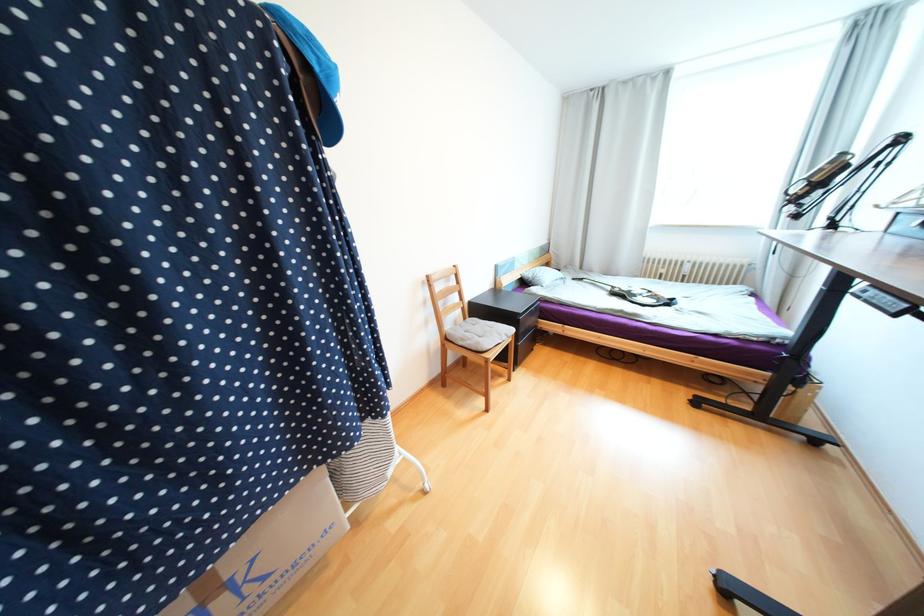
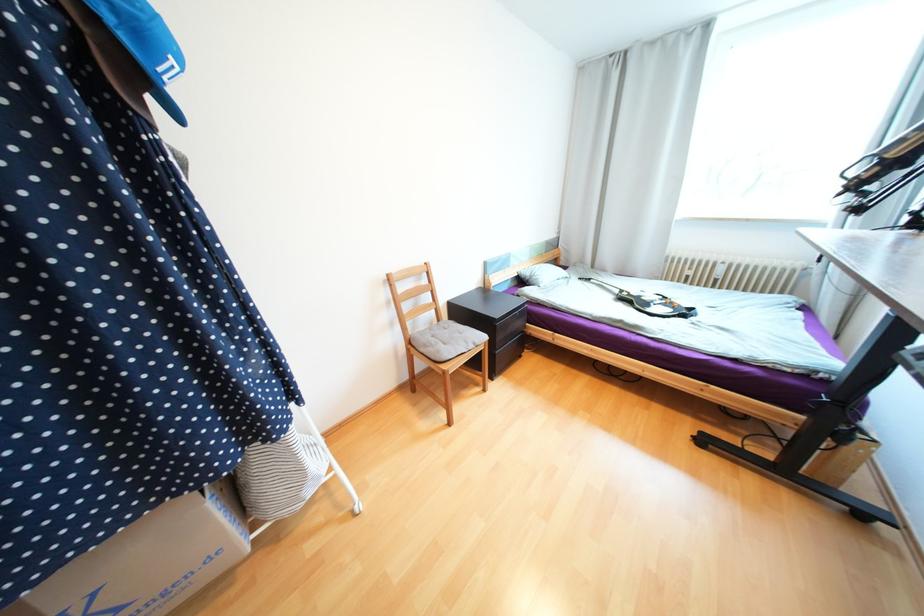
The point at (x=614, y=288) is marked in the first image. Where is the corresponding point in the second image?

(623, 292)